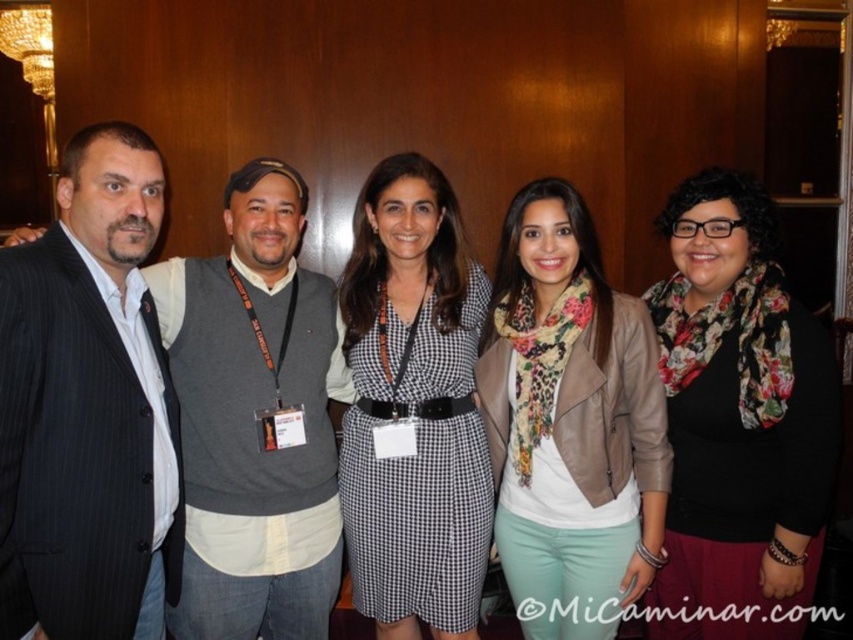
You are a photographer at a conference and need to adjust the height of your camera to capture both the matte black suit at left and the black checkered dress at center in focus. Which subject should you focus on first to ensure both are in frame?

The matte black suit at left is shorter than the black checkered dress at center. To ensure both are in focus, focus on the taller subject, the black checkered dress at center, first.

You are a photographer adjusting the lighting for a group photo. You notice the floral scarf at center and the black checkered dress at center. Which one might require more careful positioning to avoid shadows, considering their sizes?

The black checkered dress at center has a greater width than the floral scarf at center, so it might cast a larger shadow and require more careful positioning to avoid shadows.

You are a photographer adjusting the lighting for the group photo. You notice the floral scarf at center and the black checkered dress at center. Which one is positioned lower in the image?

The floral scarf at center is located below the black checkered dress at center, so it is positioned lower in the image.